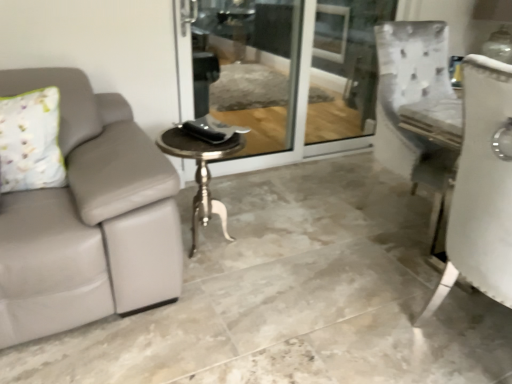
Locate an element on the screen. vacant area located to the right-hand side of polished silver table at center is located at coordinates (282, 249).